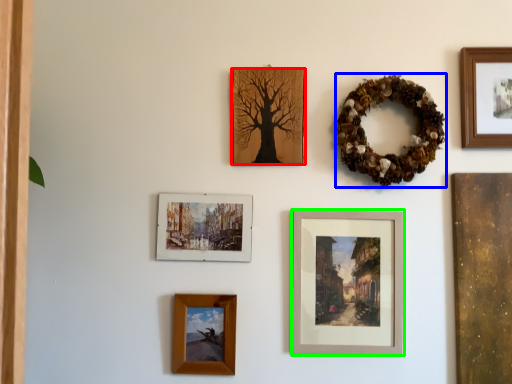
Question: Which is nearer to the picture frame (highlighted by a red box)? decor (highlighted by a blue box) or picture frame (highlighted by a green box).

Choices:
 (A) decor
 (B) picture frame

Answer: (A)